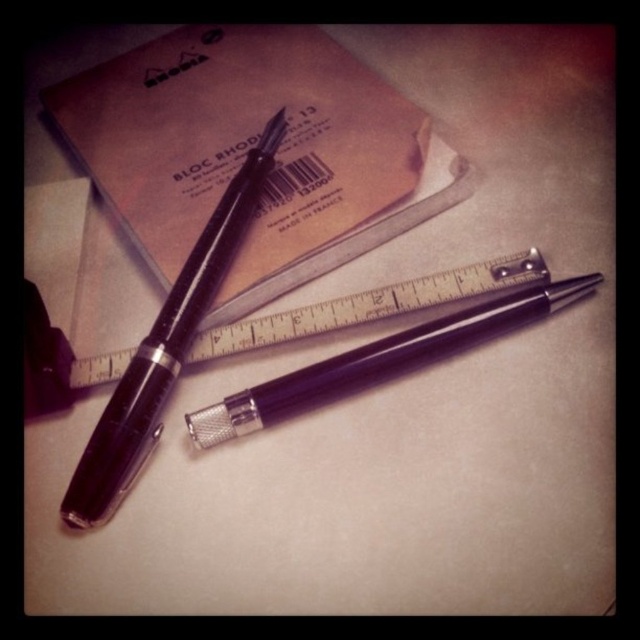
You need to choose a pen that can fit into a small pen holder on your desk. Which pen between the matte black pen at upper left and the matte black fountain pen at center is more suitable for the holder?

The matte black fountain pen at center is more suitable for the small pen holder because it has a smaller size compared to the matte black pen at upper left.

You are a photographer trying to capture a closeup of the matte black pen at upper left. You are currently standing 1 meter away from it. Can you move closer to get a better shot?

The matte black pen at upper left is 1.15 meters away from camera. Since you are standing 1 meter away, you can move 0.15 meters closer to get a better shot.

You have a small container that can only hold items narrower than 2 centimeters. You need to place either the matte black fountain pen at center or the metallic silver ruler at center into it. Which object can fit inside the container?

The matte black fountain pen at center can fit inside the container because its width is less than 2 centimeters, while the metallic silver ruler at center is wider and cannot fit.